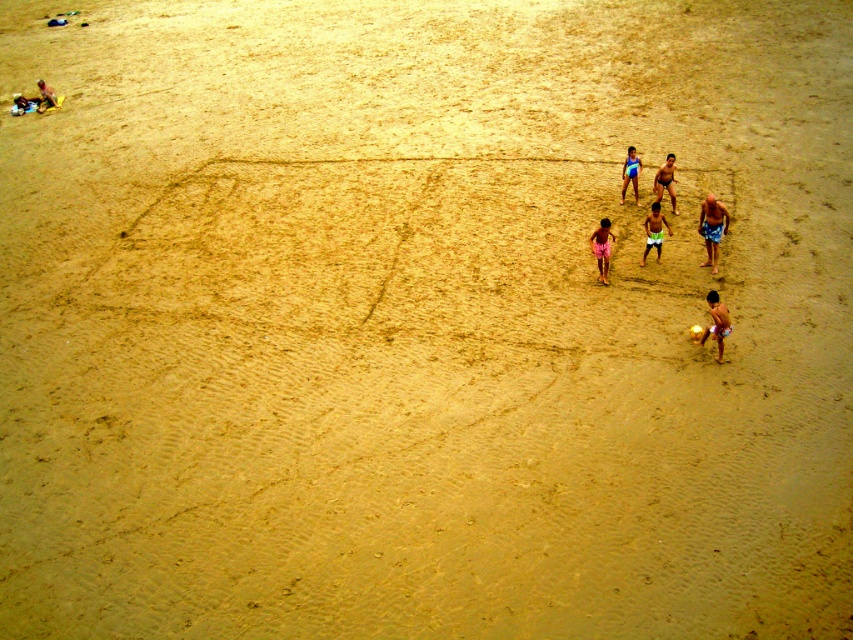
Does blue patterned shorts at center-right appear on the right side of blue fabric swimsuit at center?

Yes, blue patterned shorts at center-right is to the right of blue fabric swimsuit at center.

Can you confirm if blue patterned shorts at center-right is taller than blue fabric swimsuit at center?

Yes.

Who is more distant from viewer, (705, 237) or (636, 161)?

Point (636, 161)

At what (x,y) coordinates should I click in order to perform the action: click on blue patterned shorts at center-right. Please return your answer as a coordinate pair (x, y). The image size is (853, 640). Looking at the image, I should click on (712, 227).

Is point (601, 257) positioned after point (660, 250)?

No, (601, 257) is in front of (660, 250).

Can you confirm if pink fabric shorts at center is wider than green shorts at center?

No, pink fabric shorts at center is not wider than green shorts at center.

The width and height of the screenshot is (853, 640). I want to click on pink fabric shorts at center, so click(601, 248).

Can you confirm if blue patterned shorts at center-right is positioned below green shorts at center?

No, blue patterned shorts at center-right is not below green shorts at center.

Between point (717, 234) and point (659, 216), which one is positioned behind?

Positioned behind is point (717, 234).

You are a GUI agent. You are given a task and a screenshot of the screen. Output one action in this format:
    pyautogui.click(x=<x>, y=<y>)
    Task: Click on the blue patterned shorts at center-right
    
    Given the screenshot: What is the action you would take?
    pyautogui.click(x=712, y=227)